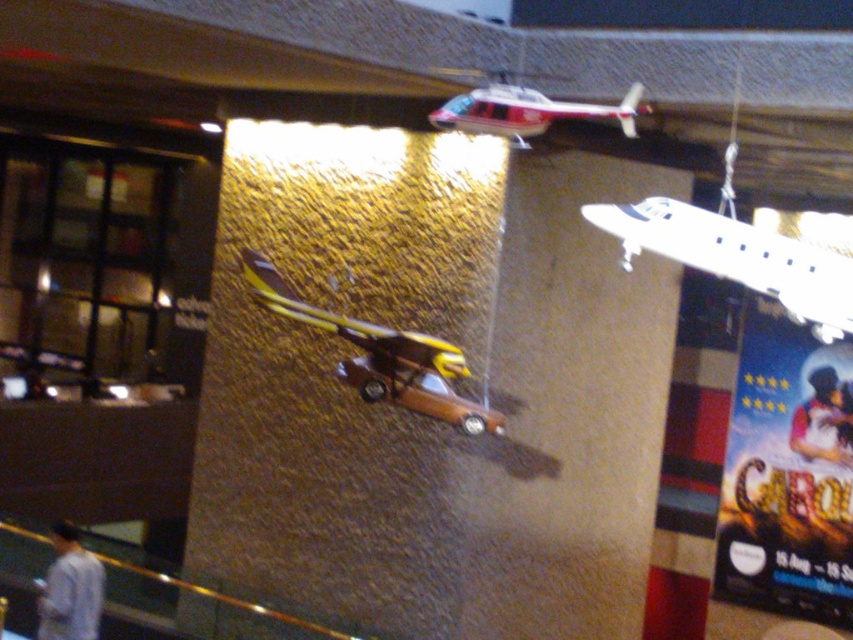
Does white matte airplane at upper right have a greater height compared to yellow matte airplane at center?

Incorrect, white matte airplane at upper right's height is not larger of yellow matte airplane at center's.

Locate an element on the screen. white matte airplane at upper right is located at coordinates (735, 257).

Which is below, blue glossy poster at upper right or white matte airplane at upper right?

blue glossy poster at upper right is below.

Where is `blue glossy poster at upper right`? This screenshot has height=640, width=853. blue glossy poster at upper right is located at coordinates (787, 476).

Where is `blue glossy poster at upper right`? The width and height of the screenshot is (853, 640). blue glossy poster at upper right is located at coordinates (787, 476).

Looking at this image, does blue glossy poster at upper right have a larger size compared to red and white plastic helicopter at upper center?

Correct, blue glossy poster at upper right is larger in size than red and white plastic helicopter at upper center.

Is blue glossy poster at upper right below red and white plastic helicopter at upper center?

Correct, blue glossy poster at upper right is located below red and white plastic helicopter at upper center.

Is point (730, 429) more distant than point (503, 96)?

Yes, it is.

Locate an element on the screen. blue glossy poster at upper right is located at coordinates (787, 476).